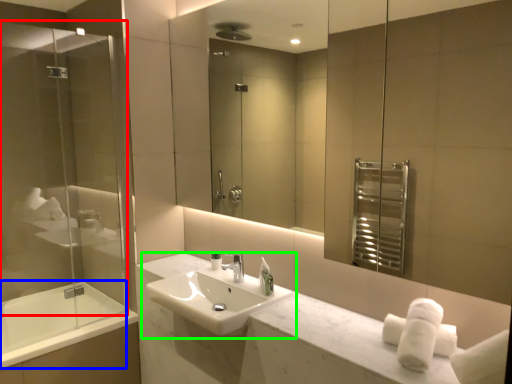
Question: Which object is the farthest from screen door (highlighted by a red box)? Choose among these: bath (highlighted by a blue box) or sink (highlighted by a green box).

Choices:
 (A) bath
 (B) sink

Answer: (B)